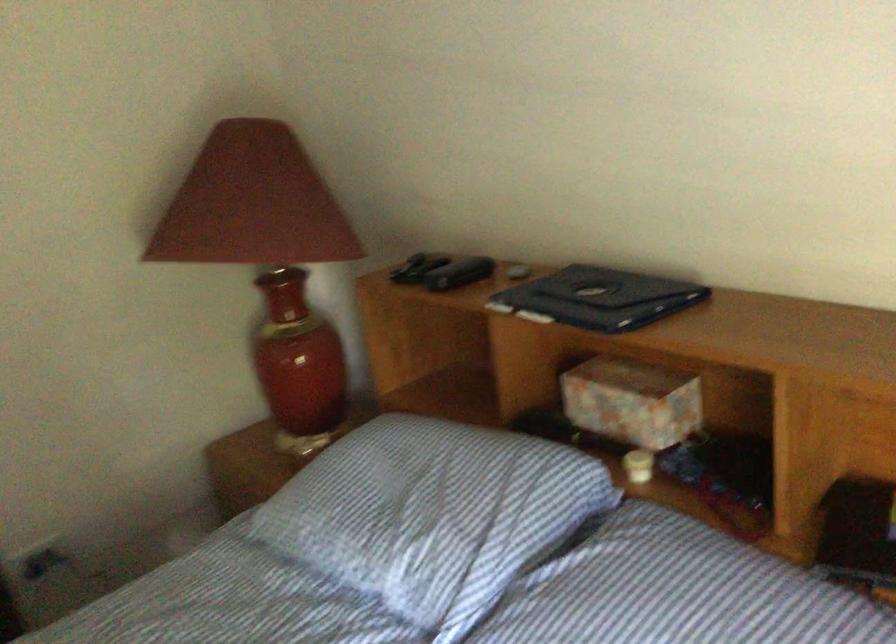
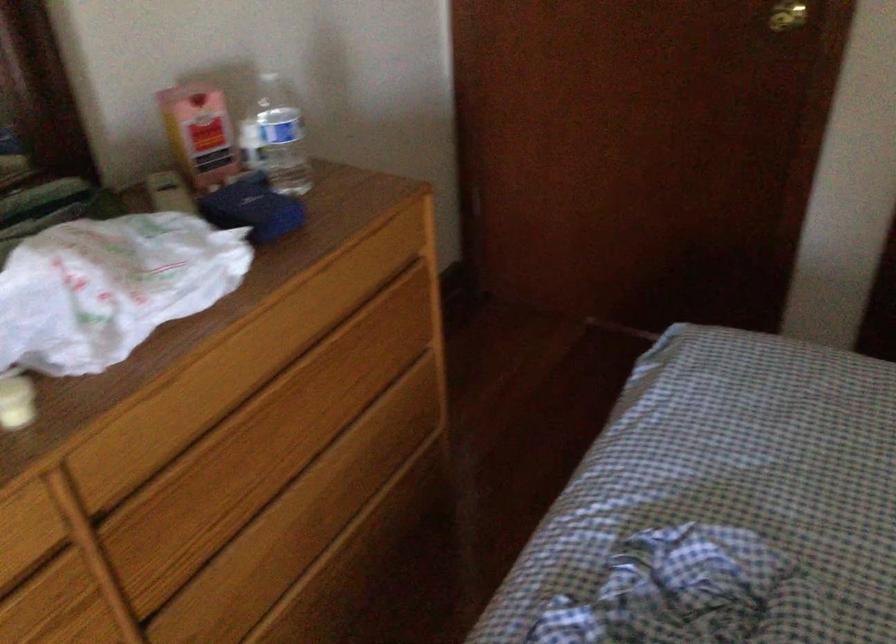
Based on the continuous images, in which direction is the camera rotating?

The camera's rotation is toward left-down.